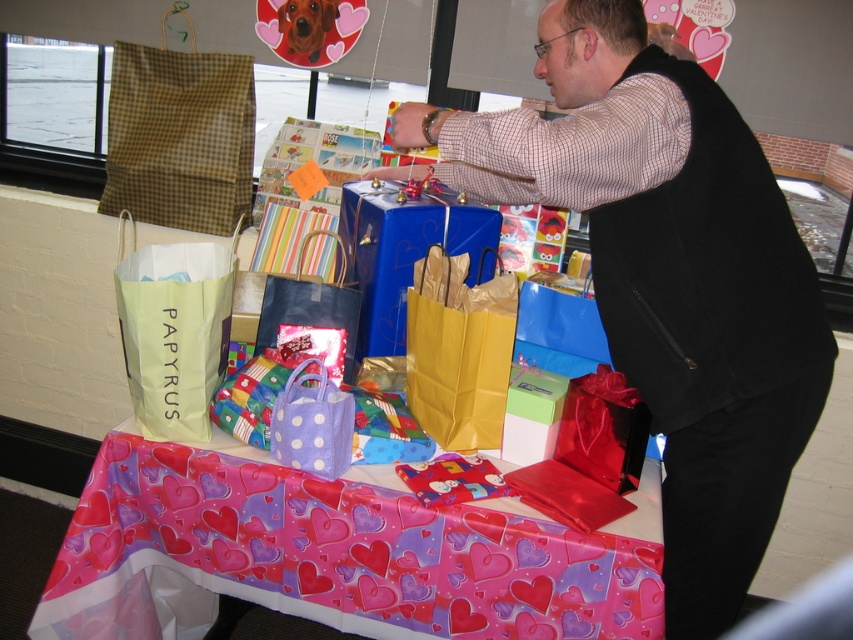
Question: Which of the following is the farthest from the observer?

Choices:
 (A) valentine-patterned paper at center
 (B) shiny black bag at lower right

Answer: (B)

Question: Can you confirm if matte black vest at center is positioned above valentine-patterned paper at center?

Choices:
 (A) no
 (B) yes

Answer: (B)

Question: In this image, where is shiny black bag at lower right located relative to purple polka dot bag at center?

Choices:
 (A) left
 (B) right

Answer: (B)

Question: Which point appears farthest from the camera in this image?

Choices:
 (A) (268, 305)
 (B) (316, 452)

Answer: (A)

Question: Which point is closer to the camera taking this photo?

Choices:
 (A) (325, 499)
 (B) (326, 422)
 (C) (613, 488)

Answer: (B)

Question: Is shiny black bag at lower right below purple polka dot bag at center?

Choices:
 (A) yes
 (B) no

Answer: (A)